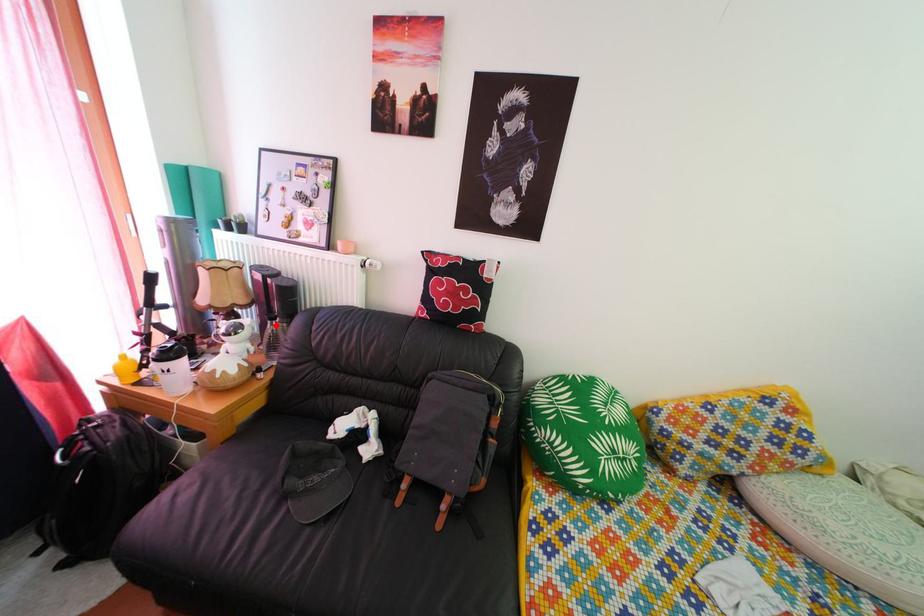
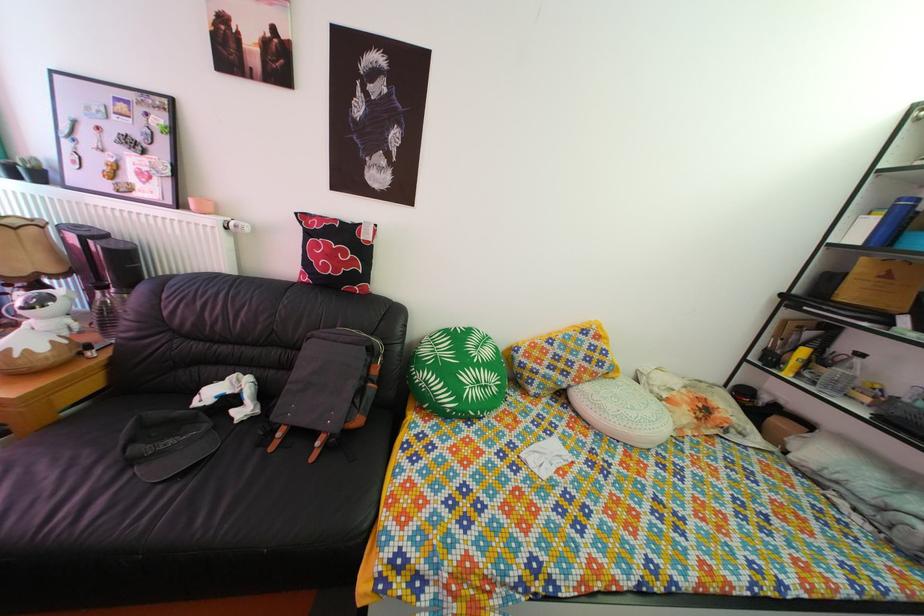
Locate, in the second image, the point that corresponds to the highlighted location in the first image.

(103, 294)